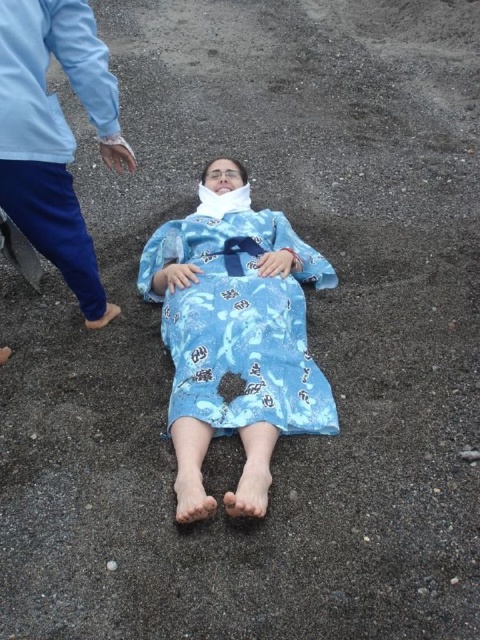
You are standing in front of the scene and want to pick up the closest item between the blue printed fabric at center and the blue printed robe at upper left. Which one should you choose?

The blue printed fabric at center is closer to the viewer, so you should pick up the blue printed fabric at center.

You are an observer looking at the scene. You notice two blue printed items in the image. Which one is taller between the blue printed fabric at center and the blue printed robe at upper left?

The blue printed fabric at center is taller than the blue printed robe at upper left.